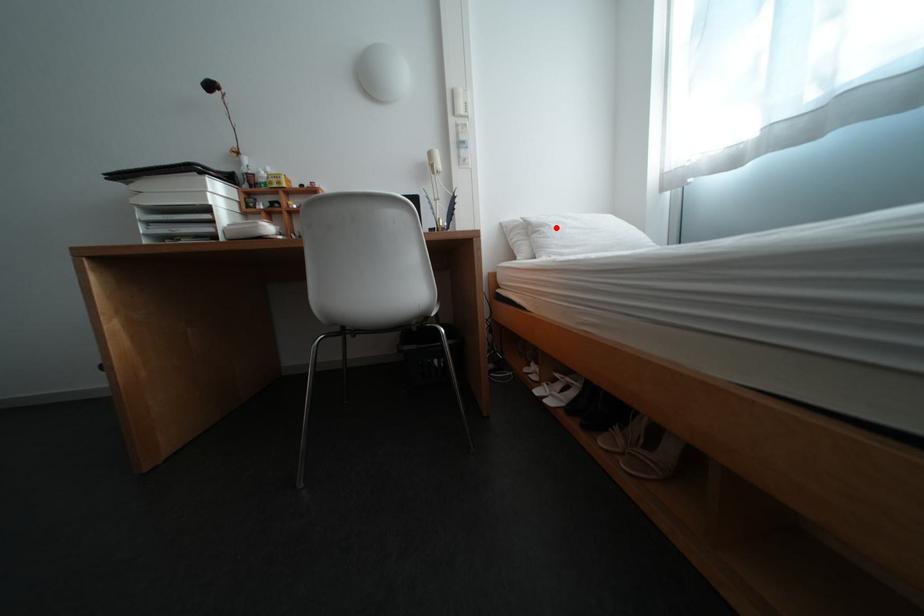
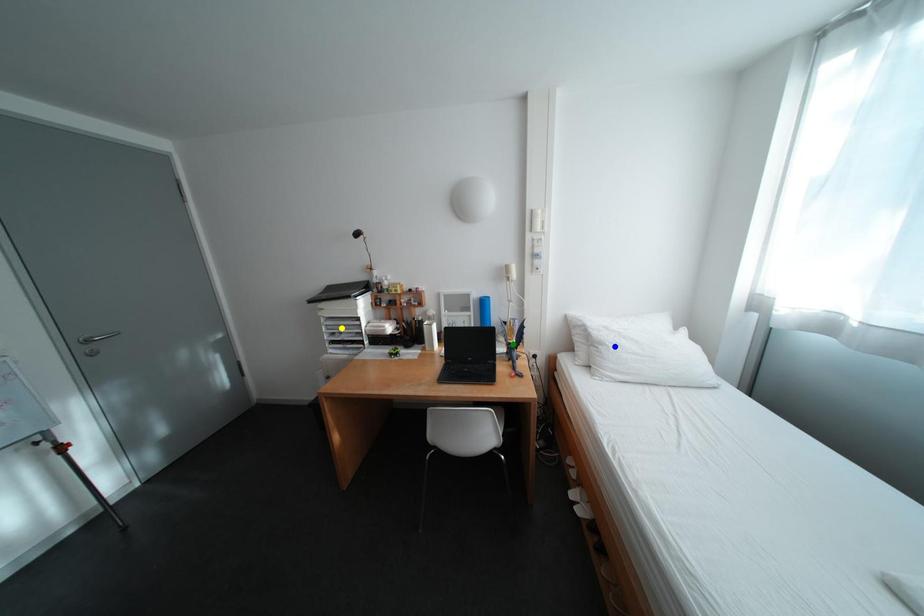
Question: I am providing you with two images of the same scene from different viewpoints. A red point is marked on the first image. You are given multiple points on the second image. Can you choose the point in image 2 that corresponds to the point in image 1?

Choices:
 (A) yellow point
 (B) green point
 (C) blue point

Answer: (C)